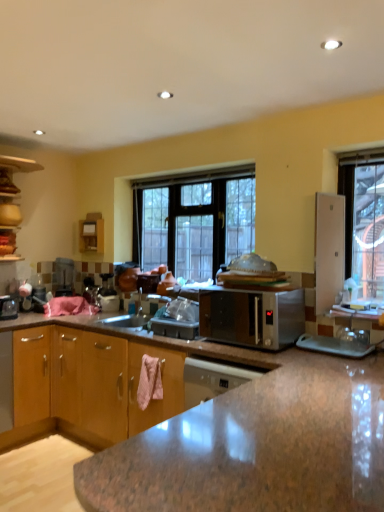
Question: From a real-world perspective, is wooden cabinet at left, which appears as the second cabinetry when viewed from the front, located higher than brown wood cabinet at lower left, which appears as the second cabinetry when viewed from the back?

Choices:
 (A) no
 (B) yes

Answer: (B)

Question: From the image's perspective, is wooden cabinet at left, acting as the second cabinetry starting from the right, below brown wood cabinet at lower left, acting as the second cabinetry starting from the top?

Choices:
 (A) no
 (B) yes

Answer: (A)

Question: From the image's perspective, does wooden cabinet at left, marked as the 2th cabinetry in a bottom-to-top arrangement, appear higher than brown wood cabinet at lower left, which appears as the second cabinetry when viewed from the back?

Choices:
 (A) no
 (B) yes

Answer: (B)

Question: Does wooden cabinet at left, the first cabinetry when ordered from top to bottom, have a larger size compared to brown wood cabinet at lower left, which appears as the second cabinetry when viewed from the back?

Choices:
 (A) no
 (B) yes

Answer: (A)

Question: Does wooden cabinet at left, the first cabinetry when ordered from top to bottom, come in front of brown wood cabinet at lower left, placed as the 1th cabinetry when sorted from front to back?

Choices:
 (A) no
 (B) yes

Answer: (A)

Question: Is clear glass window at center wider or thinner than satin silver microwave at center?

Choices:
 (A) wide
 (B) thin

Answer: (B)

Question: Is clear glass window at center taller or shorter than satin silver microwave at center?

Choices:
 (A) tall
 (B) short

Answer: (A)

Question: Is clear glass window at center in front of or behind satin silver microwave at center in the image?

Choices:
 (A) behind
 (B) front

Answer: (A)

Question: Would you say clear glass window at center is to the left or to the right of satin silver microwave at center in the picture?

Choices:
 (A) left
 (B) right

Answer: (A)

Question: In the image, is clear glass window at center on the left side or the right side of wooden cabinet at left, arranged as the 1th cabinetry when viewed from the left?

Choices:
 (A) right
 (B) left

Answer: (A)

Question: From a real-world perspective, is clear glass window at center positioned above or below wooden cabinet at left, the first cabinetry when ordered from top to bottom?

Choices:
 (A) above
 (B) below

Answer: (B)

Question: Do you think clear glass window at center is within wooden cabinet at left, acting as the second cabinetry starting from the right, or outside of it?

Choices:
 (A) inside
 (B) outside

Answer: (B)

Question: From the image's perspective, relative to wooden cabinet at left, the first cabinetry when ordered from top to bottom, is clear glass window at center above or below?

Choices:
 (A) below
 (B) above

Answer: (A)

Question: Considering the positions of wooden cabinet at left, which ranks as the 1th cabinetry in back-to-front order, and satin silver microwave at center in the image, is wooden cabinet at left, which ranks as the 1th cabinetry in back-to-front order, taller or shorter than satin silver microwave at center?

Choices:
 (A) short
 (B) tall

Answer: (B)

Question: Considering the positions of point (4, 225) and point (215, 329), is point (4, 225) closer or farther from the camera than point (215, 329)?

Choices:
 (A) closer
 (B) farther

Answer: (B)